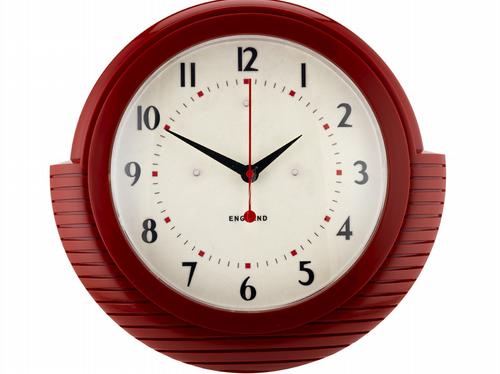
At what (x,y) coordinates should I click in order to perform the action: click on clock face. Please return your answer as a coordinate pair (x, y). Looking at the image, I should click on (291, 208).